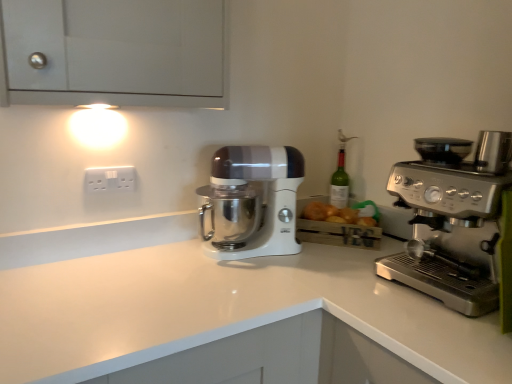
Question: Considering the relative sizes of satin silver espresso machine at right and white plastic electrical outlet at upper left in the image provided, is satin silver espresso machine at right thinner than white plastic electrical outlet at upper left?

Choices:
 (A) yes
 (B) no

Answer: (B)

Question: Is satin silver espresso machine at right closer to camera compared to white plastic electrical outlet at upper left?

Choices:
 (A) yes
 (B) no

Answer: (A)

Question: From a real-world perspective, is satin silver espresso machine at right located beneath white plastic electrical outlet at upper left?

Choices:
 (A) no
 (B) yes

Answer: (B)

Question: Is satin silver espresso machine at right surrounding white plastic electrical outlet at upper left?

Choices:
 (A) yes
 (B) no

Answer: (B)

Question: Considering the relative positions of satin silver espresso machine at right and white plastic electrical outlet at upper left in the image provided, is satin silver espresso machine at right to the left of white plastic electrical outlet at upper left from the viewer's perspective?

Choices:
 (A) yes
 (B) no

Answer: (B)

Question: Would you say satin silver espresso machine at right is to the left or to the right of white glossy stand mixer at center in the picture?

Choices:
 (A) left
 (B) right

Answer: (B)

Question: Is point (452, 167) positioned closer to the camera than point (293, 165)?

Choices:
 (A) closer
 (B) farther

Answer: (A)

Question: From their relative heights in the image, would you say satin silver espresso machine at right is taller or shorter than white glossy stand mixer at center?

Choices:
 (A) short
 (B) tall

Answer: (A)

Question: Is satin silver espresso machine at right bigger or smaller than white glossy stand mixer at center?

Choices:
 (A) small
 (B) big

Answer: (B)

Question: Is point (112, 342) closer or farther from the camera than point (119, 188)?

Choices:
 (A) closer
 (B) farther

Answer: (A)

Question: From the image's perspective, relative to white plastic electrical outlet at upper left, is white glossy countertop at center above or below?

Choices:
 (A) above
 (B) below

Answer: (B)

Question: Relative to white plastic electrical outlet at upper left, is white glossy countertop at center in front or behind?

Choices:
 (A) behind
 (B) front

Answer: (B)

Question: From a real-world perspective, relative to white plastic electrical outlet at upper left, is white glossy countertop at center vertically above or below?

Choices:
 (A) above
 (B) below

Answer: (B)

Question: Considering the positions of satin silver espresso machine at right and white glossy countertop at center in the image, is satin silver espresso machine at right bigger or smaller than white glossy countertop at center?

Choices:
 (A) big
 (B) small

Answer: (B)

Question: Is point (464, 206) closer or farther from the camera than point (89, 266)?

Choices:
 (A) farther
 (B) closer

Answer: (B)